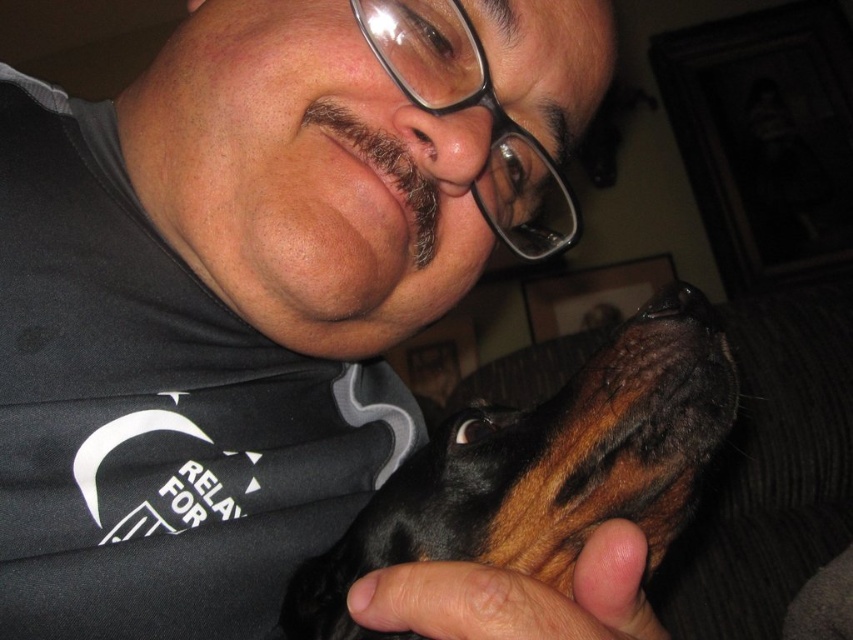
Does black matte shirt at center have a greater width compared to black shiny dog at center?

Yes, black matte shirt at center is wider than black shiny dog at center.

The height and width of the screenshot is (640, 853). What are the coordinates of `black matte shirt at center` in the screenshot? It's located at (213, 316).

Image resolution: width=853 pixels, height=640 pixels. I want to click on black matte shirt at center, so click(x=213, y=316).